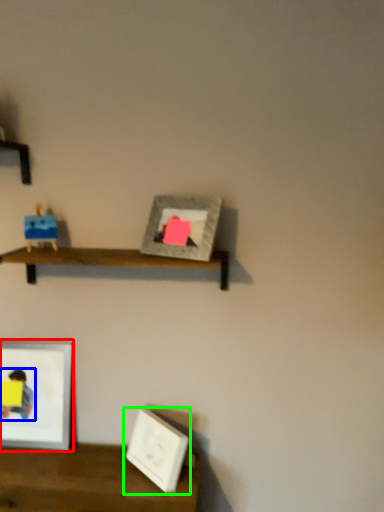
Question: Estimate the real-world distances between objects in this image. Which object is farther from picture frame (highlighted by a red box), person (highlighted by a blue box) or picture frame (highlighted by a green box)?

Choices:
 (A) person
 (B) picture frame

Answer: (B)